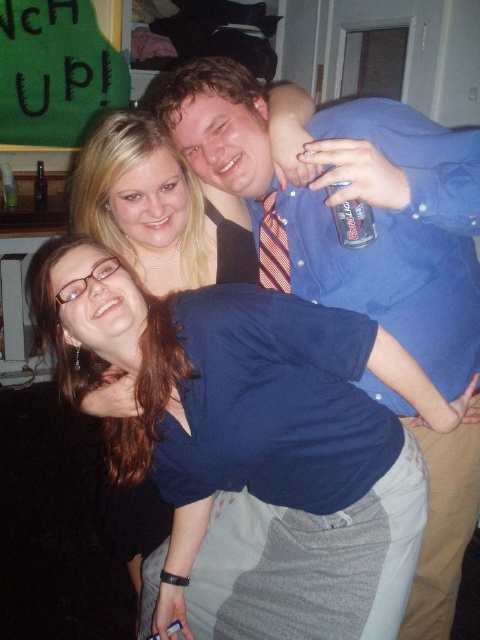
Who is taller, blue shirt at center or striped fabric tie at center?

Standing taller between the two is blue shirt at center.

Who is positioned more to the right, blue shirt at center or striped fabric tie at center?

blue shirt at center

Locate an element on the screen. The width and height of the screenshot is (480, 640). blue shirt at center is located at coordinates (354, 198).

I want to click on blue shirt at center, so click(x=354, y=198).

Does blue fabric shirt at lower center have a lesser height compared to striped fabric tie at center?

No, blue fabric shirt at lower center is not shorter than striped fabric tie at center.

Which is behind, point (131, 225) or point (278, 291)?

Point (131, 225)

What do you see at coordinates (156, 209) in the screenshot? I see `blue fabric shirt at lower center` at bounding box center [156, 209].

This screenshot has height=640, width=480. I want to click on blue fabric shirt at lower center, so click(156, 209).

In the scene shown: Is blue shirt at center positioned behind blue fabric shirt at lower center?

No.

Does blue shirt at center appear under blue fabric shirt at lower center?

Indeed, blue shirt at center is positioned under blue fabric shirt at lower center.

Does point (465, 474) lie behind point (141, 250)?

No.

Find the location of a particular element. The width and height of the screenshot is (480, 640). blue shirt at center is located at coordinates (354, 198).